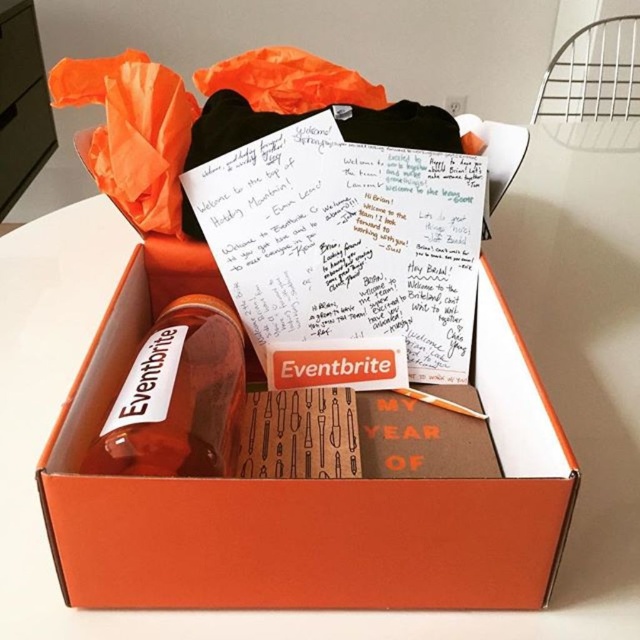
You are organizing a gift and need to place both the orange matte box at center and the orange matte drawer at upper left into a storage container. Based on their widths, which one will require more space horizontally?

The orange matte box at center has a greater width than the orange matte drawer at upper left, so it will require more horizontal space.

You are organizing a gift box and need to retrieve the orange matte drawer at upper left from behind the translucent glass bottle at center. Can you do this without moving the bottle?

The translucent glass bottle at center is in front of the orange matte drawer at upper left, so you cannot retrieve the orange matte drawer at upper left without moving the bottle.